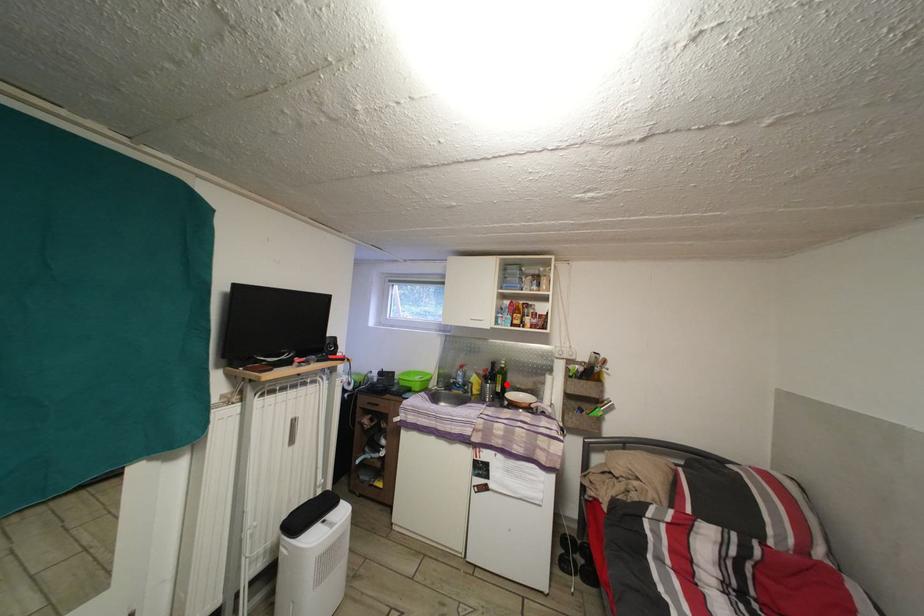
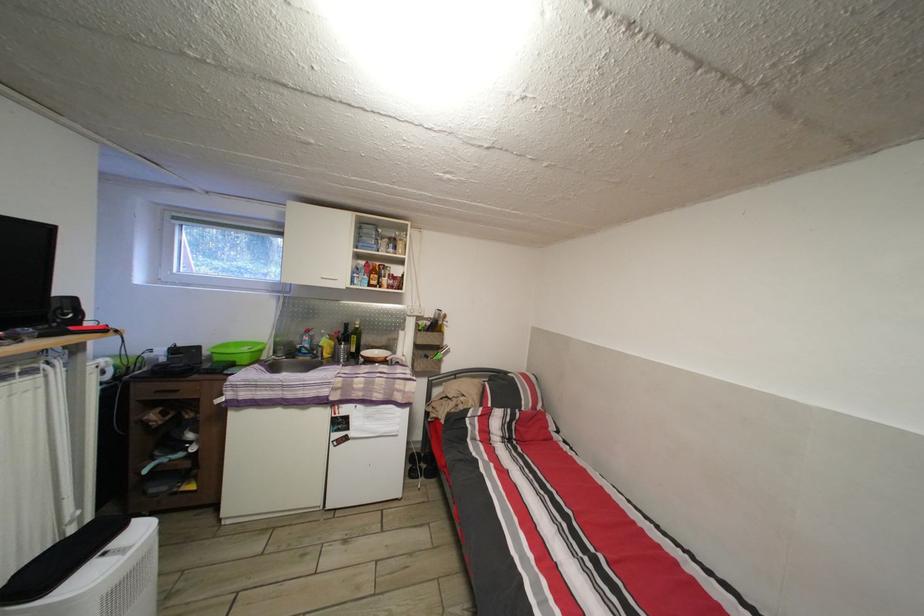
Question: I am providing you with two images of the same scene from different viewpoints. Image1 has a red point marked. In image2, the corresponding 3D location appears at what relative position? Reply with the corresponding letter.

Choices:
 (A) Closer
 (B) Farther

Answer: (A)